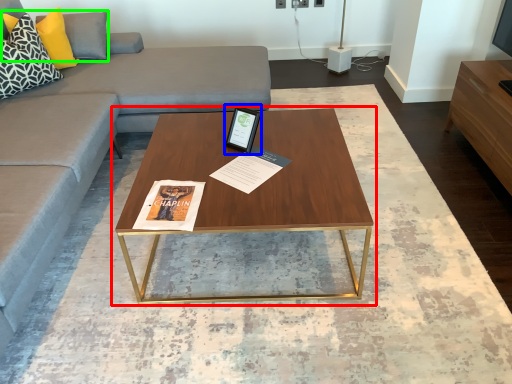
Question: Which is nearer to the coffee table (highlighted by a red box)? tablet computer (highlighted by a blue box) or pillow (highlighted by a green box).

Choices:
 (A) tablet computer
 (B) pillow

Answer: (A)